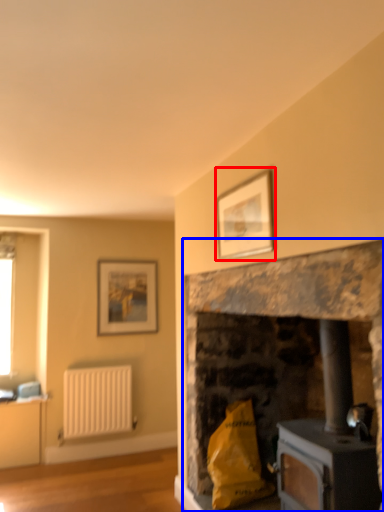
Question: Which point is closer to the camera, picture frame (highlighted by a red box) or fireplace (highlighted by a blue box)?

Choices:
 (A) picture frame
 (B) fireplace

Answer: (B)